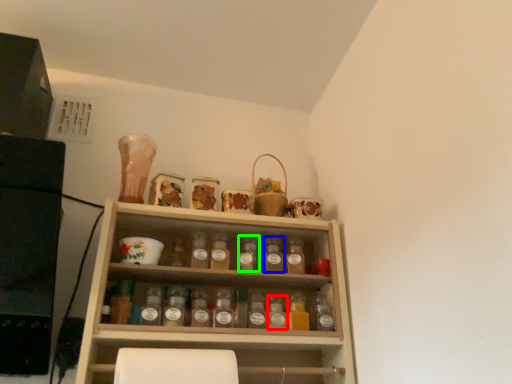
Question: Considering the real-world distances, which object is closest to bottle (highlighted by a red box)? bottle (highlighted by a blue box) or bottle (highlighted by a green box).

Choices:
 (A) bottle
 (B) bottle

Answer: (A)